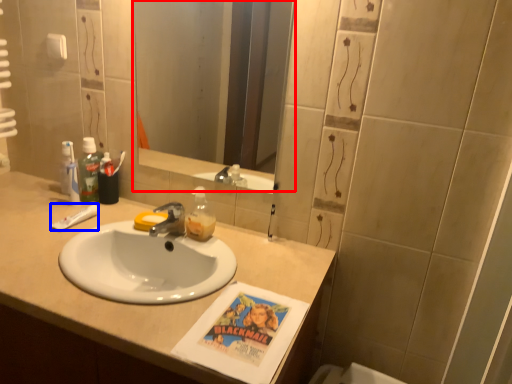
Question: Which of the following is the farthest to the observer, mirror (highlighted by a red box) or toothpaste (highlighted by a blue box)?

Choices:
 (A) mirror
 (B) toothpaste

Answer: (B)